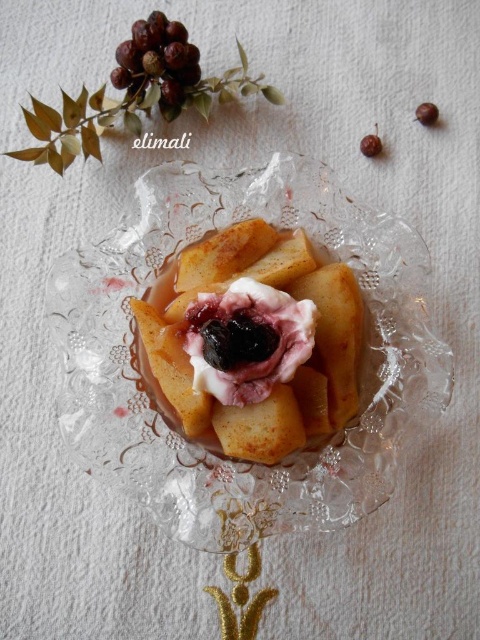
Question: Can you confirm if slightly browned crumbly cake at center is smaller than brown matte berries at upper left?

Choices:
 (A) no
 (B) yes

Answer: (A)

Question: Can you confirm if clear glass platter at center is positioned to the left of brown matte berry at upper right?

Choices:
 (A) no
 (B) yes

Answer: (B)

Question: Estimate the real-world distances between objects in this image. Which object is closer to the brown matte hazelnut at upper right?

Choices:
 (A) brown matte berries at upper left
 (B) brown matte berry at upper right

Answer: (B)

Question: Which of the following is the closest to the observer?

Choices:
 (A) brown matte berry at upper right
 (B) brown matte berries at upper left

Answer: (B)

Question: Can you confirm if slightly browned crumbly cake at center is smaller than brown matte hazelnut at upper right?

Choices:
 (A) yes
 (B) no

Answer: (B)

Question: Among these objects, which one is nearest to the camera?

Choices:
 (A) slightly browned crumbly cake at center
 (B) brown matte hazelnut at upper right
 (C) brown matte berries at upper left

Answer: (A)